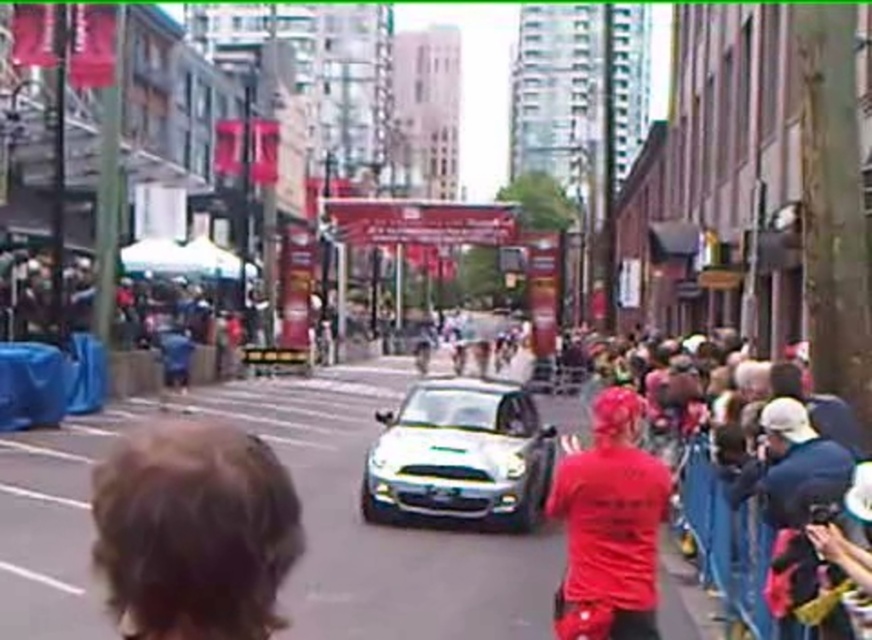
Question: Can you confirm if red fabric crowd at right is positioned above red matte shirt at center?

Choices:
 (A) no
 (B) yes

Answer: (A)

Question: Can you confirm if brown curly hair at lower left is positioned below white metallic sports car at center?

Choices:
 (A) no
 (B) yes

Answer: (A)

Question: Which point appears farthest from the camera in this image?

Choices:
 (A) (612, 394)
 (B) (576, 572)
 (C) (542, 440)

Answer: (C)

Question: Which object is positioned farthest from the brown curly hair at lower left?

Choices:
 (A) white metallic sports car at center
 (B) red matte shirt at center
 (C) red fabric crowd at right

Answer: (A)

Question: Among these points, which one is farthest from the camera?

Choices:
 (A) (121, 612)
 (B) (637, 401)
 (C) (489, 394)

Answer: (C)

Question: Can you confirm if brown curly hair at lower left is positioned above red matte shirt at center?

Choices:
 (A) no
 (B) yes

Answer: (B)